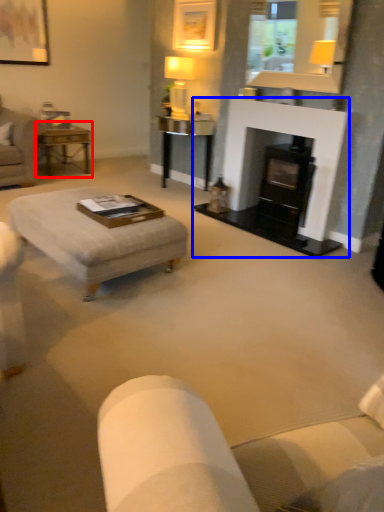
Question: Which point is closer to the camera, table (highlighted by a red box) or fireplace (highlighted by a blue box)?

Choices:
 (A) table
 (B) fireplace

Answer: (B)